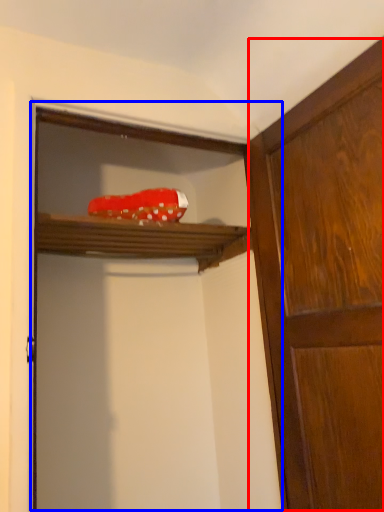
Question: Which object appears closest to the camera in this image, cabinetry (highlighted by a red box) or screen door (highlighted by a blue box)?

Choices:
 (A) cabinetry
 (B) screen door

Answer: (A)